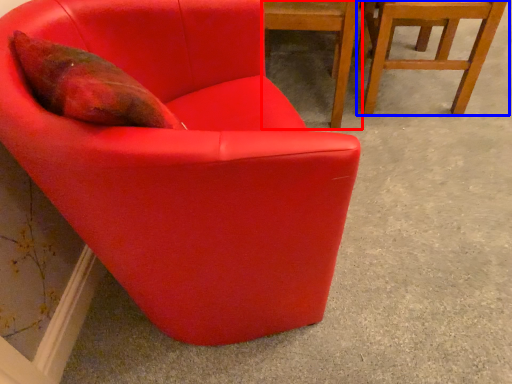
Question: Among these objects, which one is farthest to the camera, chair (highlighted by a red box) or chair (highlighted by a blue box)?

Choices:
 (A) chair
 (B) chair

Answer: (B)